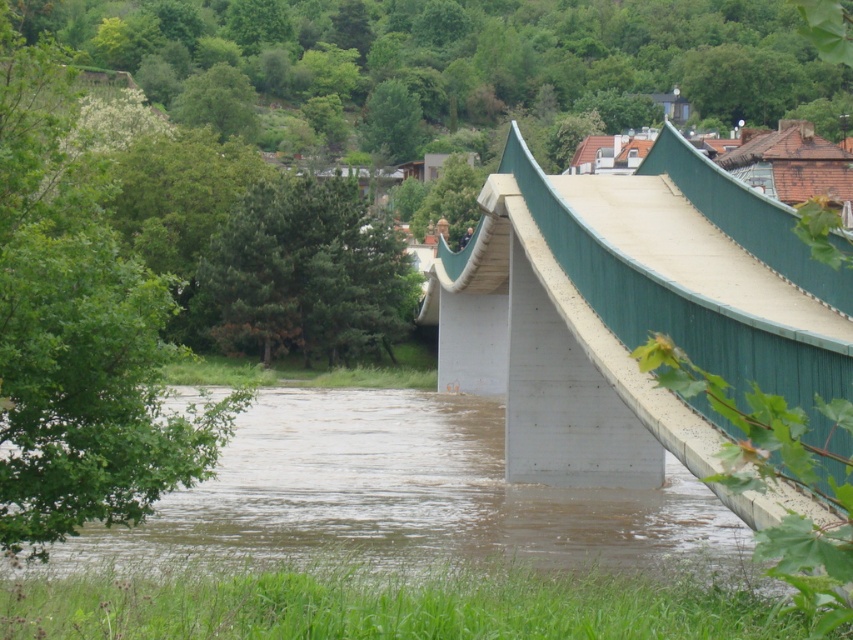
Question: Among these objects, which one is farthest from the camera?

Choices:
 (A) concrete bridge at center
 (B) brown concrete river at lower center

Answer: (B)

Question: In this image, where is concrete bridge at center located relative to brown concrete river at lower center?

Choices:
 (A) below
 (B) above

Answer: (B)

Question: Which point is closer to the camera?

Choices:
 (A) brown concrete river at lower center
 (B) concrete bridge at center

Answer: (B)

Question: Is concrete bridge at center further to camera compared to brown concrete river at lower center?

Choices:
 (A) yes
 (B) no

Answer: (B)

Question: Does concrete bridge at center appear on the right side of brown concrete river at lower center?

Choices:
 (A) no
 (B) yes

Answer: (B)